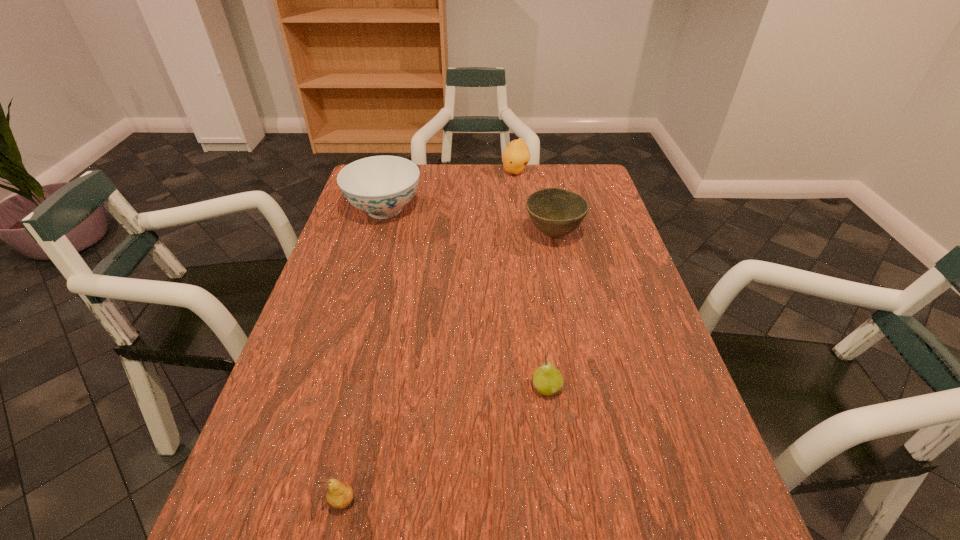
Locate an element on the screen. empty space that is in between the chinaware and the tallest pear is located at coordinates (450, 191).

Identify which object is located as the second nearest to the farthest pear. Please provide its 2D coordinates. Your answer should be formatted as a tuple, i.e. [(x, y)], where the tuple contains the x and y coordinates of a point satisfying the conditions above.

[(381, 186)]

Locate which object ranks in proximity to the nearest pear. Please provide its 2D coordinates. Your answer should be formatted as a tuple, i.e. [(x, y)], where the tuple contains the x and y coordinates of a point satisfying the conditions above.

[(548, 381)]

Where is `the second closest pear relative to the bowl`? Image resolution: width=960 pixels, height=540 pixels. the second closest pear relative to the bowl is located at coordinates (548, 381).

The height and width of the screenshot is (540, 960). Find the location of `pear that stands as the third closest to the bowl`. pear that stands as the third closest to the bowl is located at coordinates (340, 495).

Locate an element on the screen. The height and width of the screenshot is (540, 960). vacant space that satisfies the following two spatial constraints: 1. on the back side of the nearest object; 2. on the left side of the farthest object is located at coordinates (416, 172).

This screenshot has height=540, width=960. I want to click on free spot that satisfies the following two spatial constraints: 1. on the front side of the chinaware; 2. on the left side of the second nearest pear, so click(333, 388).